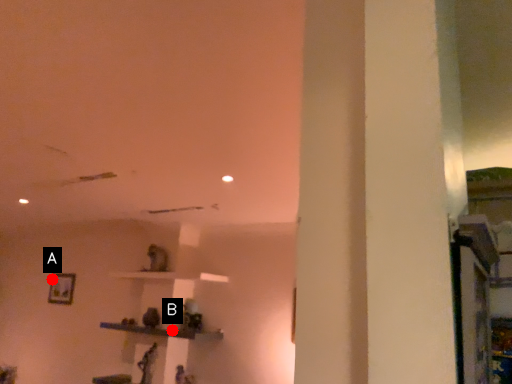
Question: Two points are circled on the image, labeled by A and B beside each circle. Among these points, which one is nearest to the camera?

Choices:
 (A) A is closer
 (B) B is closer

Answer: (B)